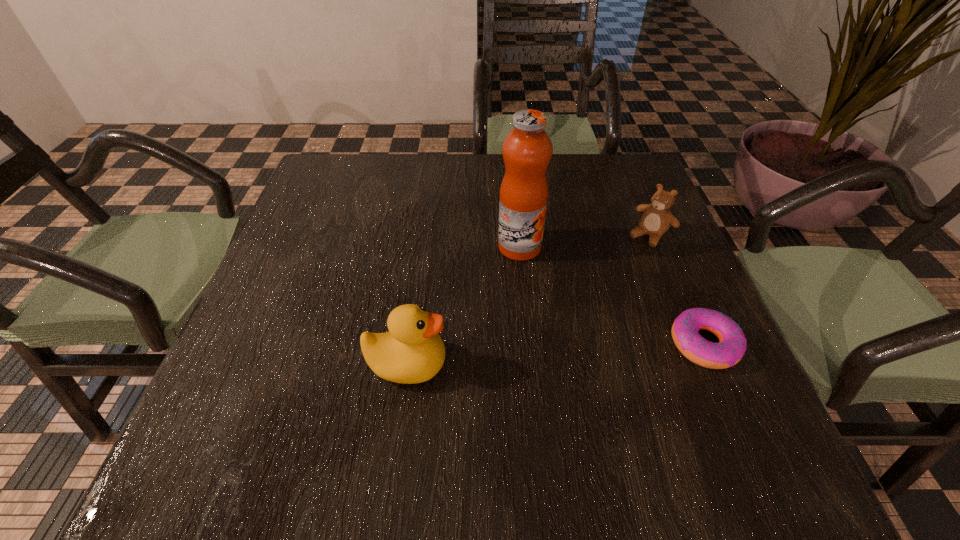
The image size is (960, 540). I want to click on free point between the third shortest object and the doughnut, so click(556, 354).

The width and height of the screenshot is (960, 540). What are the coordinates of `vacant area that lies between the doughnut and the second object from left to right` in the screenshot? It's located at (612, 295).

Where is `free space between the third shortest object and the teddy bear`? This screenshot has height=540, width=960. free space between the third shortest object and the teddy bear is located at coordinates (528, 300).

Where is `vacant area that lies between the leftmost object and the doughnut`? vacant area that lies between the leftmost object and the doughnut is located at coordinates (556, 354).

Identify the location of free spot between the shortest object and the fruit juice. (612, 295).

Locate which object is the closest to the second object from left to right. Please provide its 2D coordinates. Your answer should be formatted as a tuple, i.e. [(x, y)], where the tuple contains the x and y coordinates of a point satisfying the conditions above.

[(656, 219)]

Identify which object is located as the third nearest to the duck. Please provide its 2D coordinates. Your answer should be formatted as a tuple, i.e. [(x, y)], where the tuple contains the x and y coordinates of a point satisfying the conditions above.

[(656, 219)]